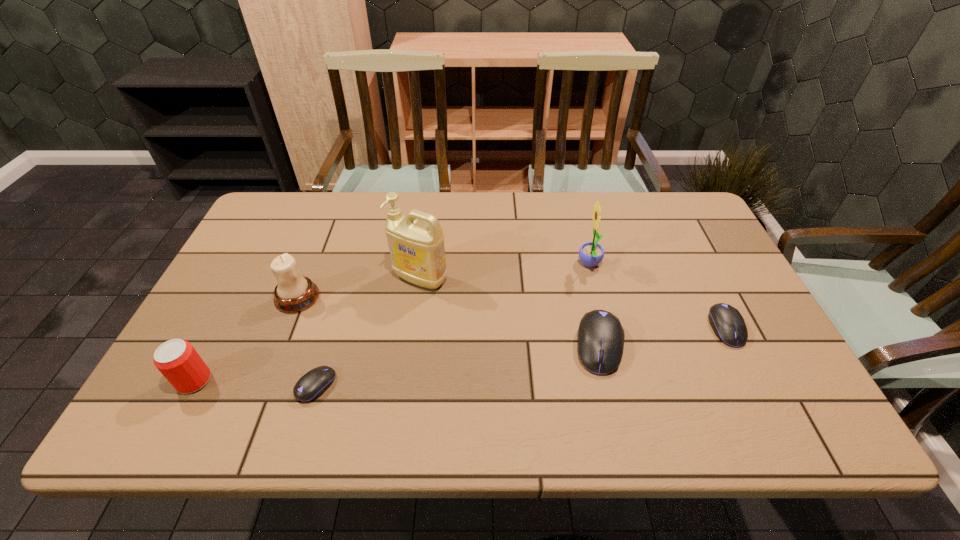
Locate an element on the screen. The image size is (960, 540). vacant space that is in between the fifth object from right to left and the sixth tallest object is located at coordinates (521, 357).

Where is `free area in between the fifth object from right to left and the beer can`? This screenshot has width=960, height=540. free area in between the fifth object from right to left and the beer can is located at coordinates (255, 383).

Identify the location of blank region between the fourth object from right to left and the second shortest computer mouse. The width and height of the screenshot is (960, 540). (573, 303).

You are a GUI agent. You are given a task and a screenshot of the screen. Output one action in this format:
    pyautogui.click(x=<x>, y=<y>)
    Task: Click on the second closest object to the candle holder
    
    Given the screenshot: What is the action you would take?
    pyautogui.click(x=177, y=360)

Locate which object ranks fifth in proximity to the rightmost object. Please provide its 2D coordinates. Your answer should be formatted as a tuple, i.e. [(x, y)], where the tuple contains the x and y coordinates of a point satisfying the conditions above.

[(294, 292)]

Identify the location of computer mouse that is the second closest to the detergent. The image size is (960, 540). (601, 336).

Locate an element on the screen. This screenshot has height=540, width=960. the closest computer mouse to the rightmost computer mouse is located at coordinates (601, 336).

Identify the location of free spot that satisfies the following two spatial constraints: 1. on the front-facing side of the second tallest object; 2. on the front side of the third object from left to right. (620, 386).

Where is `vacant space that satisfies the following two spatial constraints: 1. on the back side of the fifth tallest object; 2. on the right side of the second shortest object`? vacant space that satisfies the following two spatial constraints: 1. on the back side of the fifth tallest object; 2. on the right side of the second shortest object is located at coordinates (595, 328).